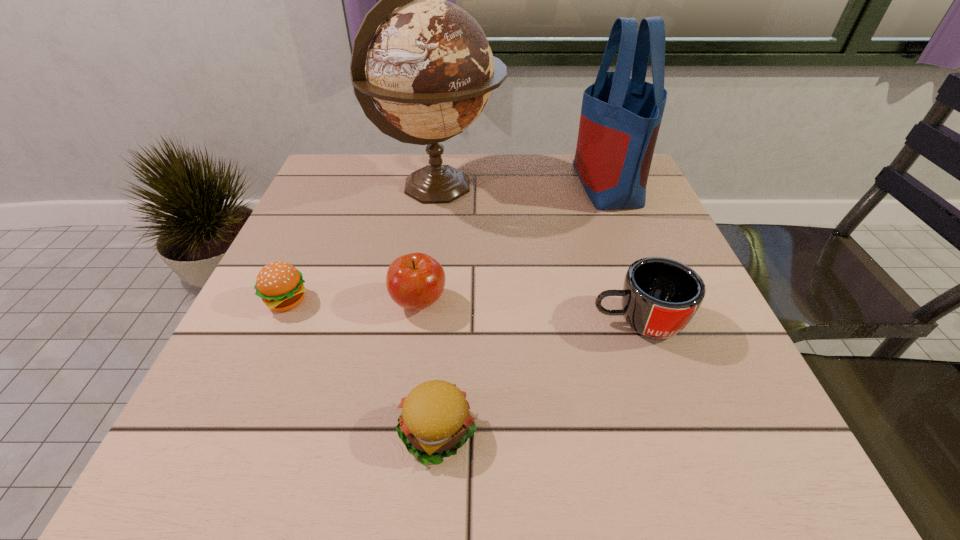
I want to click on hamburger at the left edge, so click(x=280, y=285).

The width and height of the screenshot is (960, 540). Identify the location of handbag located at the right edge. (620, 119).

You are a GUI agent. You are given a task and a screenshot of the screen. Output one action in this format:
    pyautogui.click(x=<x>, y=<y>)
    Task: Click on the mug that is positioned at the right edge
    Image resolution: width=960 pixels, height=540 pixels.
    Given the screenshot: What is the action you would take?
    660,296

This screenshot has width=960, height=540. In order to click on object located in the far left corner section of the desktop in this screenshot , I will do tap(426, 64).

Locate an element on the screen. object at the far right corner is located at coordinates (620, 119).

I want to click on vacant area at the far edge of the desktop, so click(x=461, y=169).

I want to click on vacant space at the near edge, so click(x=294, y=460).

In the image, there is a desktop. Where is `vacant space at the left edge`? vacant space at the left edge is located at coordinates (304, 233).

Image resolution: width=960 pixels, height=540 pixels. In the image, there is a desktop. Identify the location of vacant space at the right edge. (676, 380).

In the image, there is a desktop. In order to click on vacant space at the far left corner in this screenshot , I will do `click(312, 188)`.